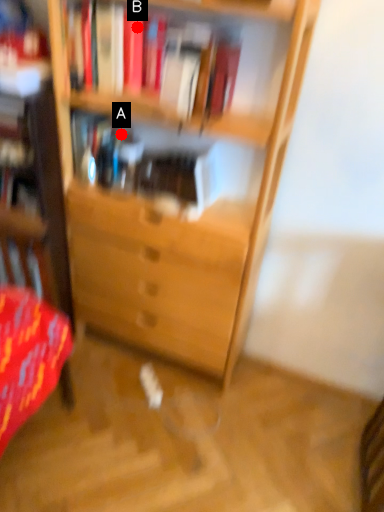
Question: Two points are circled on the image, labeled by A and B beside each circle. Which point is closer to the camera taking this photo?

Choices:
 (A) A is closer
 (B) B is closer

Answer: (B)